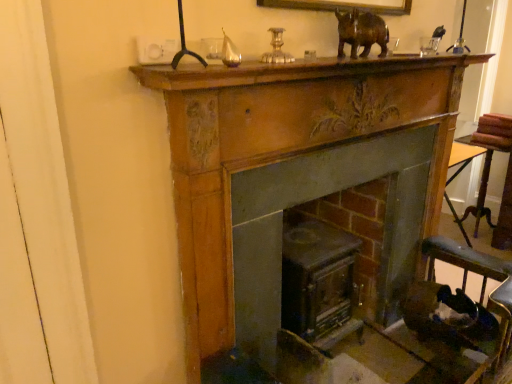
The width and height of the screenshot is (512, 384). What do you see at coordinates (458, 300) in the screenshot? I see `dark brown leather rocking chair at lower right` at bounding box center [458, 300].

The height and width of the screenshot is (384, 512). What do you see at coordinates (361, 32) in the screenshot? I see `brown polished wood rhino at upper center` at bounding box center [361, 32].

The width and height of the screenshot is (512, 384). What do you see at coordinates (325, 203) in the screenshot?
I see `smooth dark wood fireplace at center, placed as the second fireplace when sorted from right to left` at bounding box center [325, 203].

The image size is (512, 384). What are the coordinates of `dark brown leather rocking chair at lower right` in the screenshot? It's located at (458, 300).

From the image's perspective, which one is positioned higher, wooden table at right or wooden fireplace at center, placed as the 1th fireplace when sorted from right to left?

wooden table at right appears higher in the image.

Which of these two, wooden table at right or wooden fireplace at center, placed as the second fireplace when sorted from left to right, is smaller?

wooden table at right is smaller.

How many degrees apart are the facing directions of wooden table at right and wooden fireplace at center, placed as the second fireplace when sorted from left to right?

The angle between the facing direction of wooden table at right and the facing direction of wooden fireplace at center, placed as the second fireplace when sorted from left to right, is 93.3 degrees.

Which is more distant, (449, 295) or (417, 129)?

Positioned behind is point (449, 295).

Based on the photo, from the image's perspective, which one is positioned higher, dark brown leather rocking chair at lower right or smooth dark wood fireplace at center, placed as the second fireplace when sorted from right to left?

smooth dark wood fireplace at center, placed as the second fireplace when sorted from right to left, appears higher in the image.

Can you confirm if dark brown leather rocking chair at lower right is thinner than smooth dark wood fireplace at center, placed as the second fireplace when sorted from right to left?

Yes.

Could you tell me if dark brown leather rocking chair at lower right is turned towards smooth dark wood fireplace at center, placed as the second fireplace when sorted from right to left?

No, dark brown leather rocking chair at lower right is not facing towards smooth dark wood fireplace at center, placed as the second fireplace when sorted from right to left.

Measure the distance between wooden mantle at upper center and dark brown leather rocking chair at lower right.

The distance of wooden mantle at upper center from dark brown leather rocking chair at lower right is 3.42 feet.

Looking at this image, considering the sizes of objects wooden mantle at upper center and dark brown leather rocking chair at lower right in the image provided, who is bigger, wooden mantle at upper center or dark brown leather rocking chair at lower right?

dark brown leather rocking chair at lower right is bigger.

How different are the orientations of wooden mantle at upper center and dark brown leather rocking chair at lower right in degrees?

0.806 degrees.

Considering their positions, is wooden mantle at upper center located in front of or behind dark brown leather rocking chair at lower right?

wooden mantle at upper center is in front of dark brown leather rocking chair at lower right.

Locate an element on the screen. table located on the right of smooth dark wood fireplace at center, placed as the second fireplace when sorted from right to left is located at coordinates (462, 157).

Can you confirm if smooth dark wood fireplace at center, placed as the second fireplace when sorted from right to left, is shorter than wooden table at right?

No, smooth dark wood fireplace at center, placed as the second fireplace when sorted from right to left, is not shorter than wooden table at right.

Is point (329, 164) positioned behind point (469, 245)?

That is False.

Considering the relative sizes of smooth dark wood fireplace at center, placed as the 1th fireplace when sorted from left to right, and wooden table at right in the image provided, is smooth dark wood fireplace at center, placed as the 1th fireplace when sorted from left to right, thinner than wooden table at right?

In fact, smooth dark wood fireplace at center, placed as the 1th fireplace when sorted from left to right, might be wider than wooden table at right.

From a real-world perspective, who is located lower, brown polished wood rhino at upper center or wooden table at right?

wooden table at right, from a real-world perspective.

Is brown polished wood rhino at upper center closer to camera compared to wooden table at right?

That is True.

Are brown polished wood rhino at upper center and wooden table at right beside each other?

No, brown polished wood rhino at upper center is not with wooden table at right.

Is point (346, 20) less distant than point (454, 142)?

Yes, it is in front of point (454, 142).

Considering the sizes of dark brown leather rocking chair at lower right and wooden mantle at upper center in the image, is dark brown leather rocking chair at lower right taller or shorter than wooden mantle at upper center?

dark brown leather rocking chair at lower right is taller than wooden mantle at upper center.

Is point (432, 257) farther from camera compared to point (376, 66)?

Yes, point (432, 257) is farther from viewer.

From the image's perspective, which is above, dark brown leather rocking chair at lower right or wooden mantle at upper center?

wooden mantle at upper center appears higher in the image.

Considering the relative sizes of dark brown leather rocking chair at lower right and wooden mantle at upper center in the image provided, is dark brown leather rocking chair at lower right thinner than wooden mantle at upper center?

No.

What's the angular difference between smooth dark wood fireplace at center, placed as the 1th fireplace when sorted from left to right, and wooden fireplace at center, placed as the 1th fireplace when sorted from right to left,'s facing directions?

The angular difference between smooth dark wood fireplace at center, placed as the 1th fireplace when sorted from left to right, and wooden fireplace at center, placed as the 1th fireplace when sorted from right to left, is 0.00287 degrees.

Are smooth dark wood fireplace at center, placed as the 1th fireplace when sorted from left to right, and wooden fireplace at center, placed as the 1th fireplace when sorted from right to left, beside each other?

Yes.

Considering the sizes of smooth dark wood fireplace at center, placed as the second fireplace when sorted from right to left, and wooden fireplace at center, placed as the 1th fireplace when sorted from right to left, in the image, is smooth dark wood fireplace at center, placed as the second fireplace when sorted from right to left, bigger or smaller than wooden fireplace at center, placed as the 1th fireplace when sorted from right to left,?

Clearly, smooth dark wood fireplace at center, placed as the second fireplace when sorted from right to left, is larger in size than wooden fireplace at center, placed as the 1th fireplace when sorted from right to left.

Can you confirm if smooth dark wood fireplace at center, placed as the 1th fireplace when sorted from left to right, is positioned to the right of wooden fireplace at center, placed as the second fireplace when sorted from left to right?

In fact, smooth dark wood fireplace at center, placed as the 1th fireplace when sorted from left to right, is to the left of wooden fireplace at center, placed as the second fireplace when sorted from left to right.

The height and width of the screenshot is (384, 512). What are the coordinates of `table on the right of wooden fireplace at center, placed as the second fireplace when sorted from left to right` in the screenshot? It's located at (462, 157).

At what (x,y) coordinates should I click in order to perform the action: click on the 1st fireplace above the dark brown leather rocking chair at lower right (from the image's perspective). Please return your answer as a coordinate pair (x, y). The height and width of the screenshot is (384, 512). Looking at the image, I should click on (325, 203).

Consider the image. Looking at the image, which one is located closer to dark brown leather rocking chair at lower right, wooden mantle at upper center or brown polished wood rhino at upper center?

wooden mantle at upper center is closer to dark brown leather rocking chair at lower right.

Estimate the real-world distances between objects in this image. Which object is closer to smooth dark wood fireplace at center, placed as the 1th fireplace when sorted from left to right, dark brown leather rocking chair at lower right or brown polished wood rhino at upper center?

dark brown leather rocking chair at lower right is closer to smooth dark wood fireplace at center, placed as the 1th fireplace when sorted from left to right.

Looking at the image, which one is located further to smooth dark wood fireplace at center, placed as the 1th fireplace when sorted from left to right, wooden fireplace at center, placed as the 1th fireplace when sorted from right to left, or brown polished wood rhino at upper center?

brown polished wood rhino at upper center lies further to smooth dark wood fireplace at center, placed as the 1th fireplace when sorted from left to right, than the other object.

Looking at the image, which one is located further to dark brown leather rocking chair at lower right, brown polished wood rhino at upper center or wooden table at right?

wooden table at right is further to dark brown leather rocking chair at lower right.

Considering their positions, is wooden table at right positioned closer to wooden fireplace at center, placed as the second fireplace when sorted from left to right, than dark brown leather rocking chair at lower right?

Based on the image, dark brown leather rocking chair at lower right appears to be nearer to wooden fireplace at center, placed as the second fireplace when sorted from left to right.

Estimate the real-world distances between objects in this image. Which object is closer to smooth dark wood fireplace at center, placed as the second fireplace when sorted from right to left, wooden fireplace at center, placed as the second fireplace when sorted from left to right, or wooden mantle at upper center?

wooden fireplace at center, placed as the second fireplace when sorted from left to right.

Which object lies nearer to the anchor point wooden mantle at upper center, brown polished wood rhino at upper center or wooden table at right?

Based on the image, brown polished wood rhino at upper center appears to be nearer to wooden mantle at upper center.

In the scene shown: Estimate the real-world distances between objects in this image. Which object is closer to smooth dark wood fireplace at center, placed as the second fireplace when sorted from right to left, wooden mantle at upper center or wooden fireplace at center, placed as the second fireplace when sorted from left to right?

wooden fireplace at center, placed as the second fireplace when sorted from left to right.

Find the location of a particular element. This screenshot has width=512, height=384. mantle between brown polished wood rhino at upper center and dark brown leather rocking chair at lower right in the vertical direction is located at coordinates (289, 71).

Where is `fireplace between brown polished wood rhino at upper center and smooth dark wood fireplace at center, placed as the second fireplace when sorted from right to left, in the vertical direction`? The width and height of the screenshot is (512, 384). fireplace between brown polished wood rhino at upper center and smooth dark wood fireplace at center, placed as the second fireplace when sorted from right to left, in the vertical direction is located at coordinates (300, 178).

Find the location of a particular element. animal positioned between wooden mantle at upper center and wooden table at right from near to far is located at coordinates (361, 32).

What are the coordinates of `mantle between brown polished wood rhino at upper center and smooth dark wood fireplace at center, placed as the 1th fireplace when sorted from left to right, vertically` in the screenshot? It's located at (289, 71).